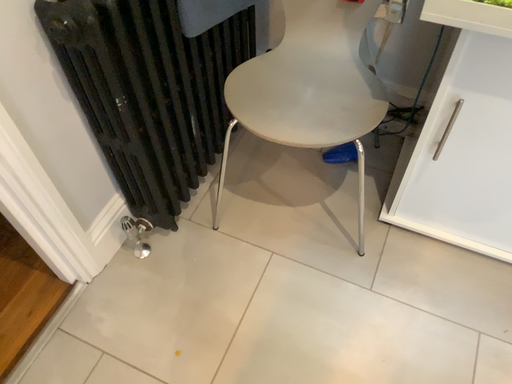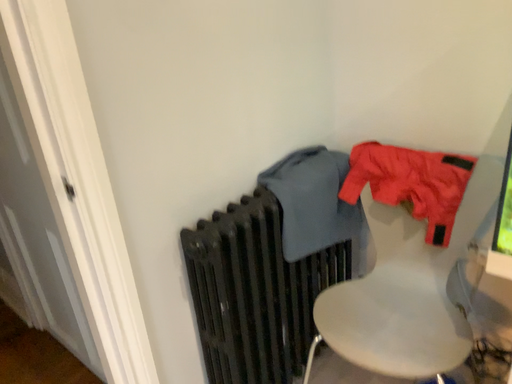
Question: How did the camera likely rotate when shooting the video?

Choices:
 (A) rotated left
 (B) rotated right

Answer: (A)